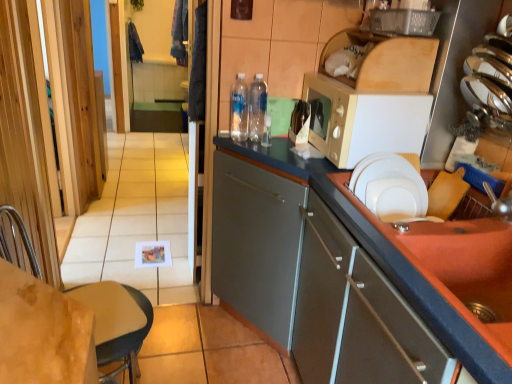
At what (x,y) coordinates should I click in order to perform the action: click on vacant space in front of translucent glass bottle at center, which is the 3th bottle in left-to-right order. Please return your answer as a coordinate pair (x, y). The width and height of the screenshot is (512, 384). Looking at the image, I should click on (301, 153).